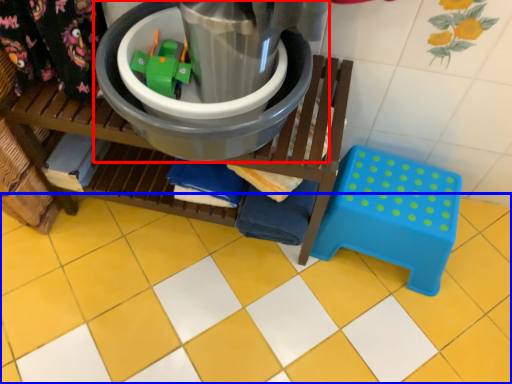
Question: Which object is further to the camera taking this photo, appliance (highlighted by a red box) or ceramic tile (highlighted by a blue box)?

Choices:
 (A) appliance
 (B) ceramic tile

Answer: (B)